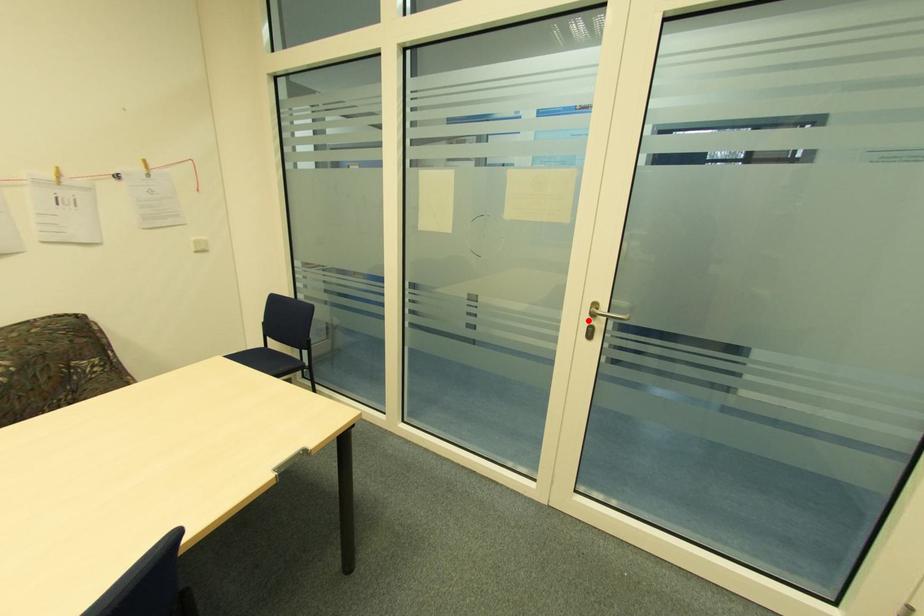
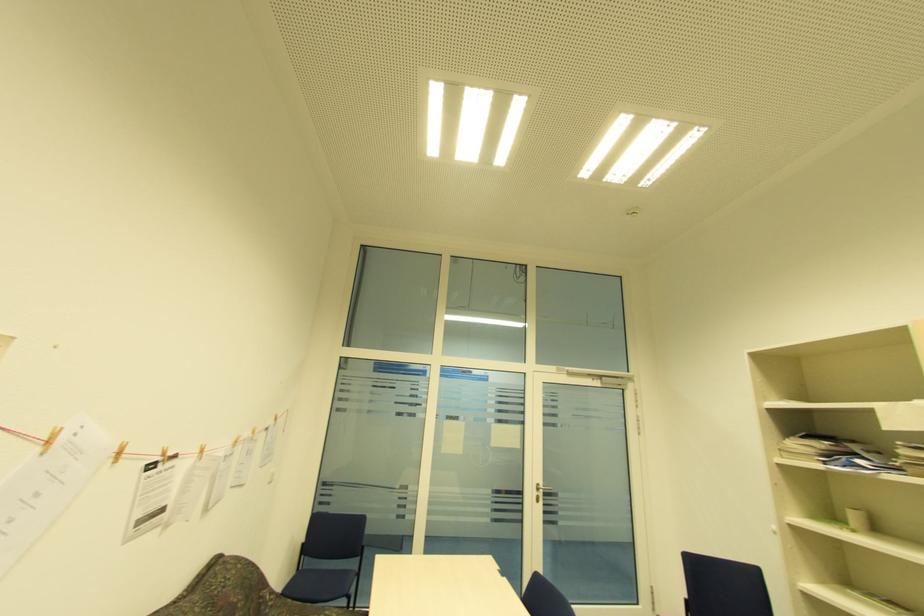
Where in the second image is the point corresponding to the highlighted location from the first image?

(538, 493)